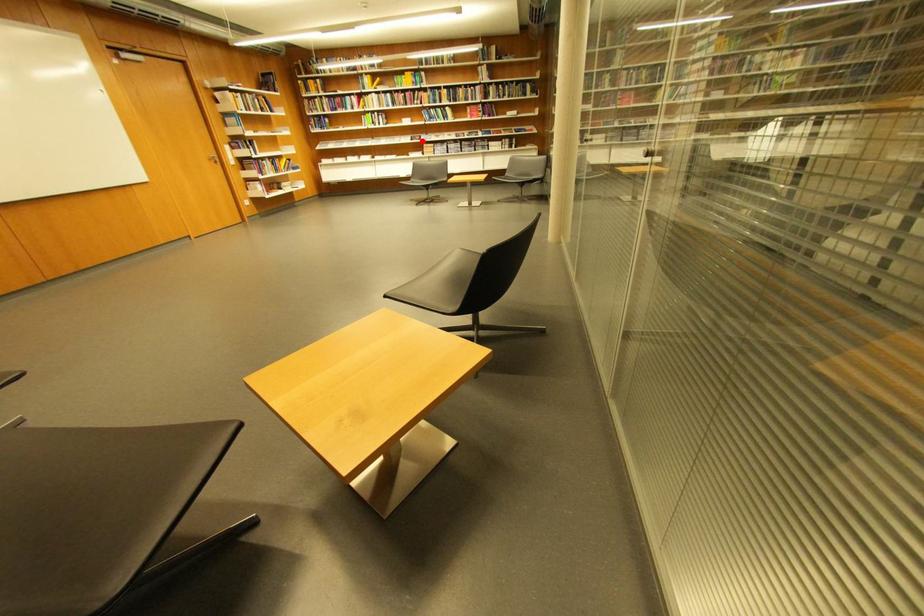
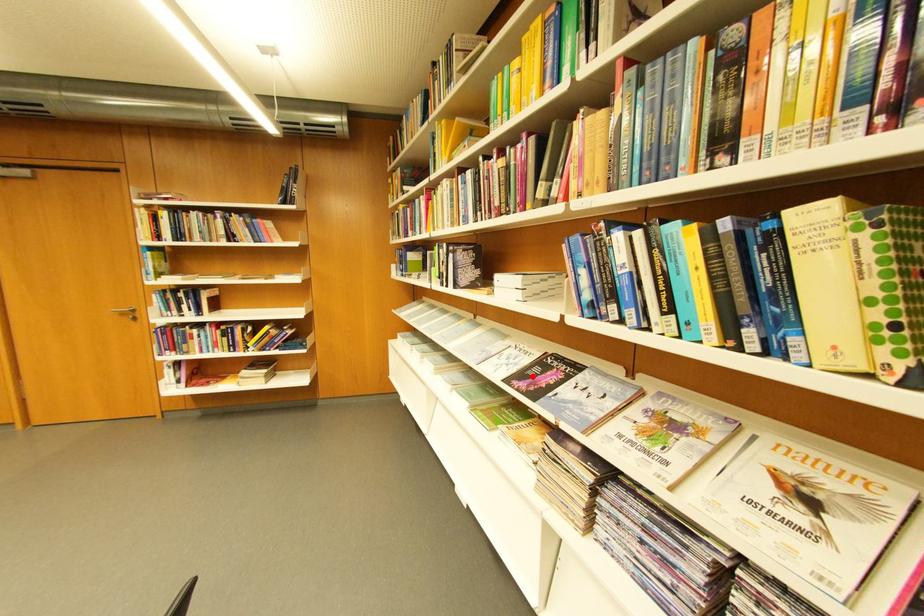
I am providing you with two images of the same scene from different viewpoints. A red point is marked on the first image and another point is marked on the second image. Are the points marked in image1 and image2 representing the same 3D position?

Yes